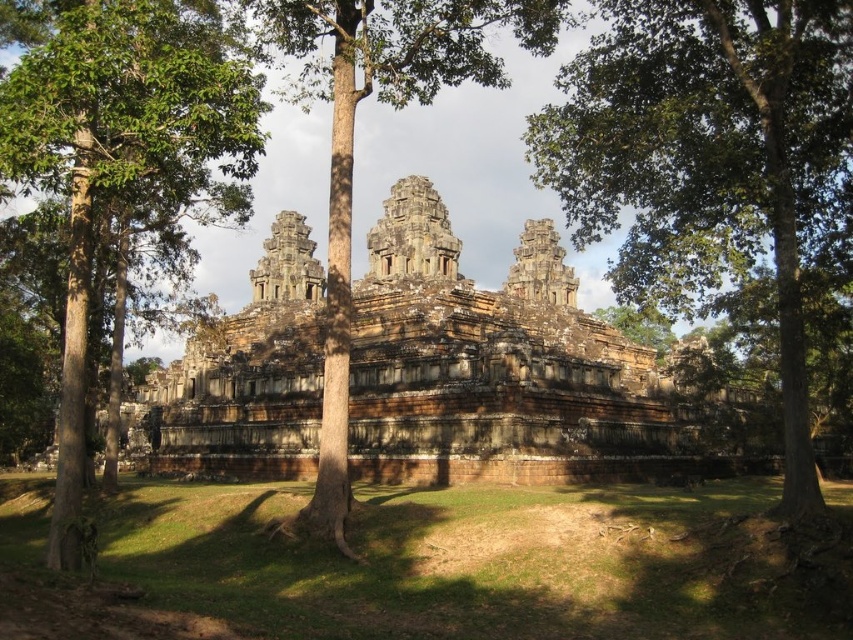
Does point (791, 209) come farther from viewer compared to point (312, 499)?

No, it is not.

Is green leafy tree at center to the right of brown wood tree at center from the viewer's perspective?

Indeed, green leafy tree at center is positioned on the right side of brown wood tree at center.

The height and width of the screenshot is (640, 853). I want to click on green leafy tree at center, so click(x=701, y=156).

The width and height of the screenshot is (853, 640). Identify the location of green leafy tree at center. (701, 156).

Can you confirm if green leafy tree at center is positioned to the left of green leafy tree at left?

No, green leafy tree at center is not to the left of green leafy tree at left.

Consider the image. Who is positioned more to the right, green leafy tree at center or green leafy tree at left?

green leafy tree at center is more to the right.

Who is more distant from viewer, (x=717, y=93) or (x=221, y=150)?

Point (x=717, y=93)

Find the location of a particular element. The width and height of the screenshot is (853, 640). green leafy tree at center is located at coordinates pos(701,156).

Can you confirm if brown wood tree at center is smaller than green leafy tree at upper center?

Incorrect, brown wood tree at center is not smaller in size than green leafy tree at upper center.

Can you confirm if brown wood tree at center is positioned below green leafy tree at upper center?

Incorrect, brown wood tree at center is not positioned below green leafy tree at upper center.

This screenshot has height=640, width=853. Find the location of `brown wood tree at center`. brown wood tree at center is located at coordinates (352, 144).

Identify the location of brown wood tree at center. (352, 144).